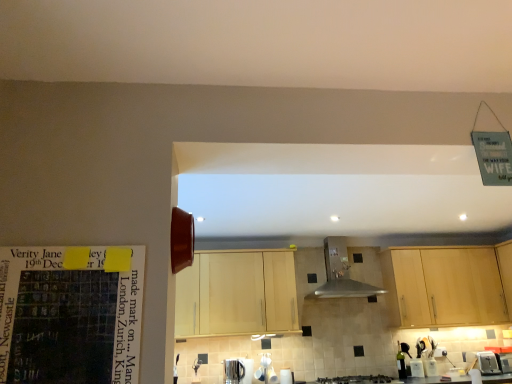
Question: Is light wood cabinet at center, acting as the 1th cabinetry starting from the left, located outside green glass bottle at lower right?

Choices:
 (A) no
 (B) yes

Answer: (B)

Question: Could you tell me if light wood cabinet at center, acting as the 1th cabinetry starting from the left, is turned towards green glass bottle at lower right?

Choices:
 (A) no
 (B) yes

Answer: (A)

Question: Is light wood cabinet at center, acting as the 1th cabinetry starting from the left, at the right side of green glass bottle at lower right?

Choices:
 (A) yes
 (B) no

Answer: (B)

Question: Considering the relative sizes of light wood cabinet at center, acting as the 1th cabinetry starting from the left, and green glass bottle at lower right in the image provided, is light wood cabinet at center, acting as the 1th cabinetry starting from the left, thinner than green glass bottle at lower right?

Choices:
 (A) no
 (B) yes

Answer: (A)

Question: From a real-world perspective, is light wood cabinet at center, acting as the 1th cabinetry starting from the left, over green glass bottle at lower right?

Choices:
 (A) no
 (B) yes

Answer: (B)

Question: Is light wood cabinet at center, acting as the 1th cabinetry starting from the left, behind green glass bottle at lower right?

Choices:
 (A) no
 (B) yes

Answer: (A)

Question: Can you confirm if white glossy kettle at lower center, which appears as the 2th appliance when viewed from the left, is thinner than metallic stainless steel kettle at lower center, placed as the second appliance when sorted from right to left?

Choices:
 (A) no
 (B) yes

Answer: (B)

Question: Can you confirm if white glossy kettle at lower center, which ranks as the first appliance in right-to-left order, is wider than metallic stainless steel kettle at lower center, placed as the second appliance when sorted from right to left?

Choices:
 (A) yes
 (B) no

Answer: (B)

Question: Is white glossy kettle at lower center, which appears as the 2th appliance when viewed from the left, oriented away from metallic stainless steel kettle at lower center, placed as the second appliance when sorted from right to left?

Choices:
 (A) no
 (B) yes

Answer: (A)

Question: Considering the relative sizes of white glossy kettle at lower center, which ranks as the first appliance in right-to-left order, and metallic stainless steel kettle at lower center, which is counted as the first appliance, starting from the left, in the image provided, is white glossy kettle at lower center, which ranks as the first appliance in right-to-left order, smaller than metallic stainless steel kettle at lower center, which is counted as the first appliance, starting from the left,?

Choices:
 (A) yes
 (B) no

Answer: (A)

Question: Is white glossy kettle at lower center, which appears as the 2th appliance when viewed from the left, bigger than metallic stainless steel kettle at lower center, placed as the second appliance when sorted from right to left?

Choices:
 (A) no
 (B) yes

Answer: (A)

Question: Is white glossy kettle at lower center, which appears as the 2th appliance when viewed from the left, touching metallic stainless steel kettle at lower center, placed as the second appliance when sorted from right to left?

Choices:
 (A) no
 (B) yes

Answer: (A)

Question: Are satin nickel faucet at lower center and matte paper calendar at left beside each other?

Choices:
 (A) yes
 (B) no

Answer: (B)